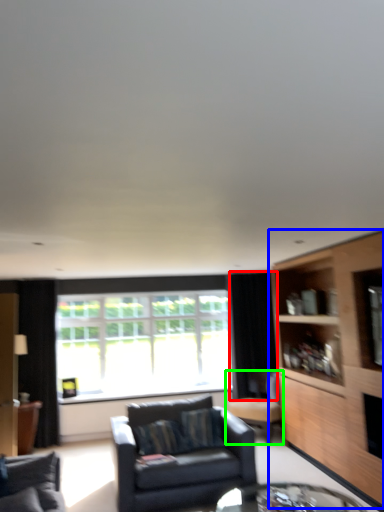
Question: Considering the real-world distances, which object is closest to curtain (highlighted by a red box)? cabinetry (highlighted by a blue box) or chair (highlighted by a green box).

Choices:
 (A) cabinetry
 (B) chair

Answer: (B)